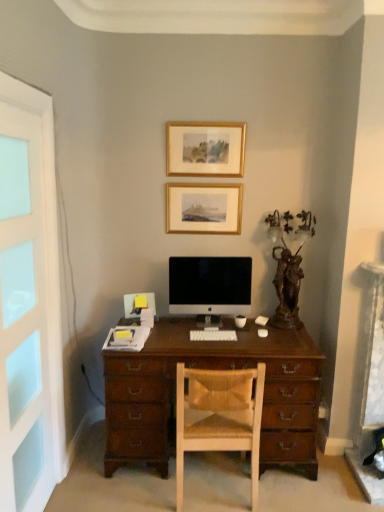
Question: From a real-world perspective, is white frosted glass screen door at left physically located above or below gold/glossy picture frame at upper center, which appears as the 1th picture frame when viewed from the top?

Choices:
 (A) above
 (B) below

Answer: (B)

Question: Considering their positions, is white frosted glass screen door at left located in front of or behind gold/glossy picture frame at upper center, which appears as the 1th picture frame when viewed from the top?

Choices:
 (A) front
 (B) behind

Answer: (A)

Question: Which is farther from the satin black monitor at center?

Choices:
 (A) white plastic keyboard at center
 (B) gold/glossy picture frame at upper center, arranged as the 1th picture frame when ordered from the bottom
 (C) gold/glossy picture frame at upper center, which appears as the 1th picture frame when viewed from the top
 (D) white frosted glass screen door at left
 (E) wooden chair with woven cushion at center

Answer: (D)

Question: Which is nearer to the gold/glossy picture frame at upper center, which is counted as the second picture frame, starting from the bottom?

Choices:
 (A) white frosted glass screen door at left
 (B) satin black monitor at center
 (C) wooden chair with woven cushion at center
 (D) gold/glossy picture frame at upper center, which is counted as the second picture frame, starting from the top
 (E) white plastic keyboard at center

Answer: (D)